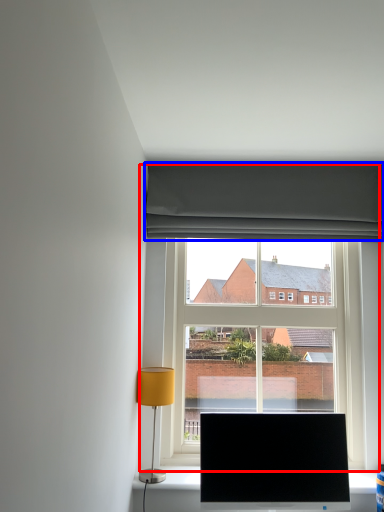
Question: Among these objects, which one is farthest to the camera, window (highlighted by a red box) or curtain (highlighted by a blue box)?

Choices:
 (A) window
 (B) curtain

Answer: (B)